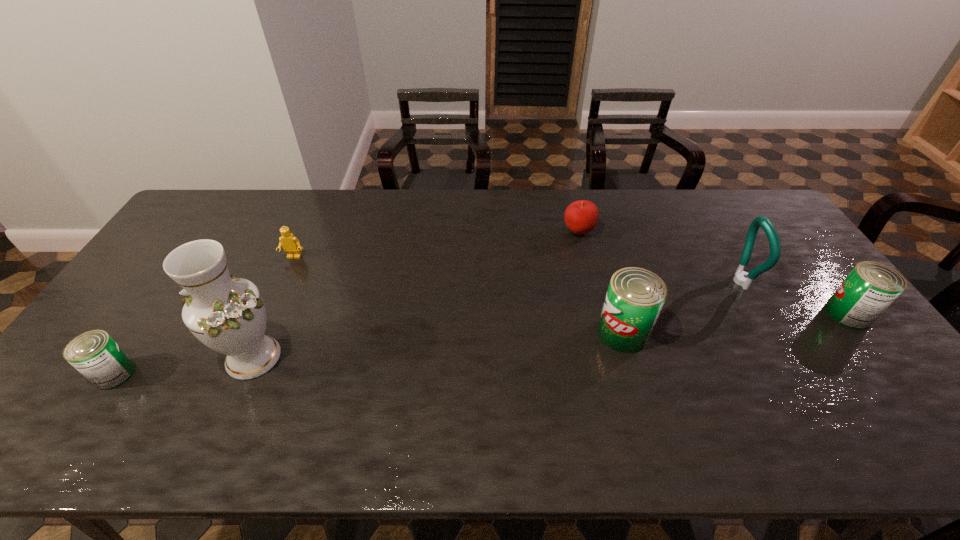
What are the coordinates of `vase` in the screenshot? It's located at (227, 314).

I want to click on vacant space located on the back of the leftmost can, so click(195, 256).

This screenshot has width=960, height=540. In order to click on vacant space situated 0.080m on the left of the tallest can in this screenshot , I will do `click(568, 333)`.

Find the location of a particular element. The image size is (960, 540). free space located on the left of the rightmost can is located at coordinates (703, 314).

You are a GUI agent. You are given a task and a screenshot of the screen. Output one action in this format:
    pyautogui.click(x=<x>, y=<y>)
    Task: Click on the free spot located on the front of the farthest object
    
    Given the screenshot: What is the action you would take?
    pyautogui.click(x=589, y=274)

Locate an element on the screen. The height and width of the screenshot is (540, 960). vacant space located on the face of the sixth nearest object is located at coordinates click(x=276, y=299).

I want to click on free point located at the jaws of the sixth object from left to right, so click(649, 281).

Identify the location of blank area located at the jaws of the sixth object from left to right. (682, 281).

Where is `free space located 0.100m at the jaws of the sixth object from left to right`? free space located 0.100m at the jaws of the sixth object from left to right is located at coordinates (695, 281).

Identify the location of free region located on the back of the tallest object. (283, 288).